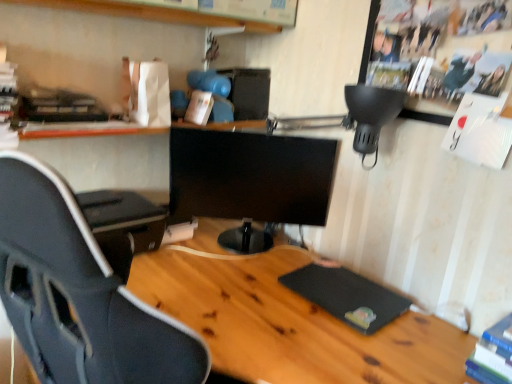
Question: Does black glossy monitor at center have a smaller size compared to wooden shelf at upper center?

Choices:
 (A) yes
 (B) no

Answer: (B)

Question: Considering the relative sizes of black glossy monitor at center and wooden shelf at upper center in the image provided, is black glossy monitor at center thinner than wooden shelf at upper center?

Choices:
 (A) yes
 (B) no

Answer: (A)

Question: From a real-world perspective, does black glossy monitor at center stand above wooden shelf at upper center?

Choices:
 (A) yes
 (B) no

Answer: (B)

Question: Does black glossy monitor at center have a lesser height compared to wooden shelf at upper center?

Choices:
 (A) no
 (B) yes

Answer: (A)

Question: Considering the relative positions of black glossy monitor at center and wooden shelf at upper center in the image provided, is black glossy monitor at center to the right of wooden shelf at upper center from the viewer's perspective?

Choices:
 (A) no
 (B) yes

Answer: (B)

Question: From a real-world perspective, is wooden desk at center physically located above or below blue hardcover book at lower right, which ranks as the second book in top-to-bottom order?

Choices:
 (A) below
 (B) above

Answer: (A)

Question: Looking at the image, does wooden desk at center seem bigger or smaller compared to blue hardcover book at lower right, which appears as the 2th book when viewed from the left?

Choices:
 (A) small
 (B) big

Answer: (B)

Question: Relative to blue hardcover book at lower right, which ranks as the second book in top-to-bottom order, is wooden desk at center in front or behind?

Choices:
 (A) front
 (B) behind

Answer: (A)

Question: Is point (228, 350) positioned closer to the camera than point (510, 352)?

Choices:
 (A) farther
 (B) closer

Answer: (A)

Question: From a real-world perspective, is black glossy monitor at center physically located above or below white matte book at upper center, the 2th book when ordered from bottom to top?

Choices:
 (A) below
 (B) above

Answer: (A)

Question: In the image, is black glossy monitor at center on the left side or the right side of white matte book at upper center, the second book when ordered from front to back?

Choices:
 (A) right
 (B) left

Answer: (A)

Question: Is black glossy monitor at center inside or outside of white matte book at upper center, the first book viewed from the left?

Choices:
 (A) inside
 (B) outside

Answer: (B)

Question: In terms of size, does black glossy monitor at center appear bigger or smaller than white matte book at upper center, the first book viewed from the left?

Choices:
 (A) big
 (B) small

Answer: (A)

Question: From the image's perspective, is black glossy monitor at center located above or below blue hardcover book at lower right, the 1th book positioned from the front?

Choices:
 (A) below
 (B) above

Answer: (B)

Question: From a real-world perspective, is black glossy monitor at center positioned above or below blue hardcover book at lower right, marked as the first book in a right-to-left arrangement?

Choices:
 (A) below
 (B) above

Answer: (B)